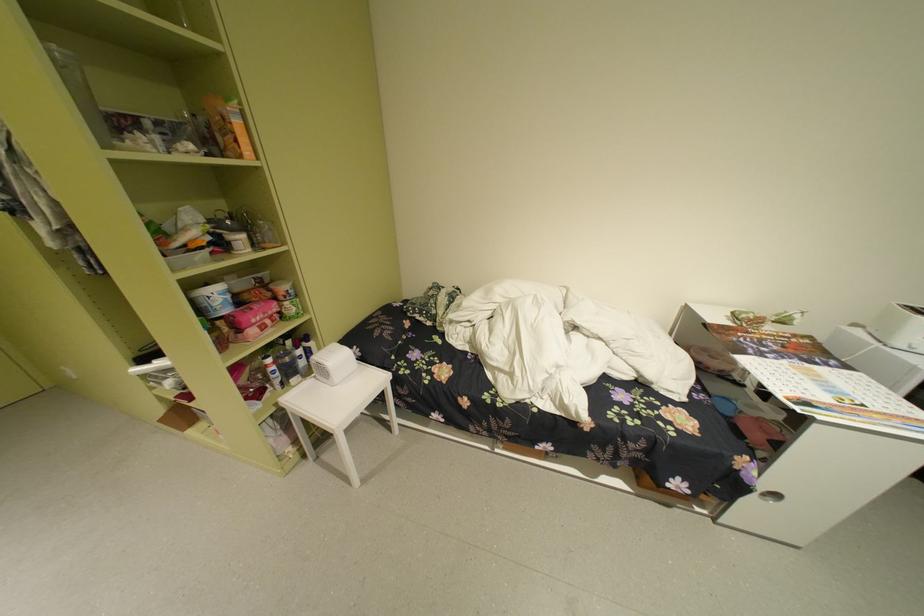
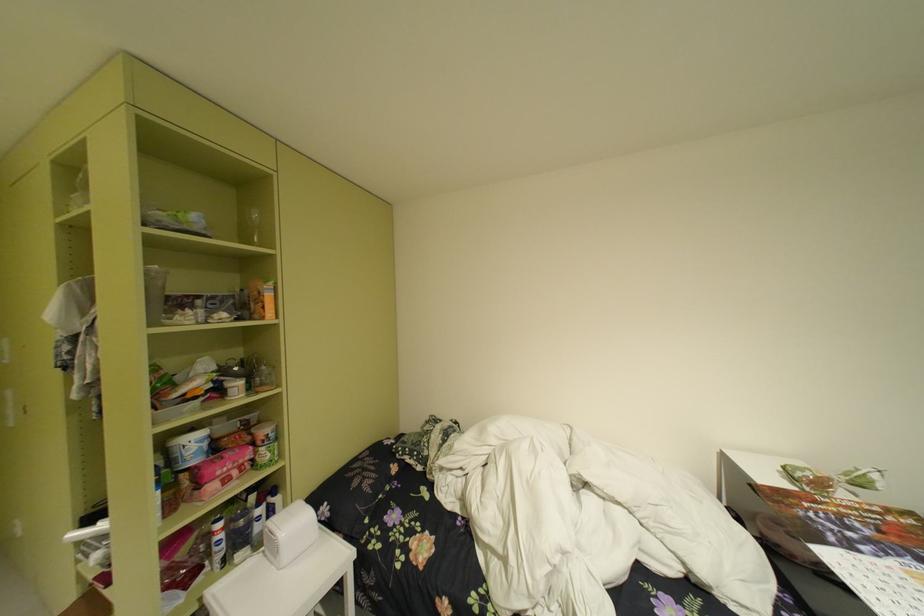
Locate, in the second image, the point that corresponds to (266,307) in the first image.

(238, 455)